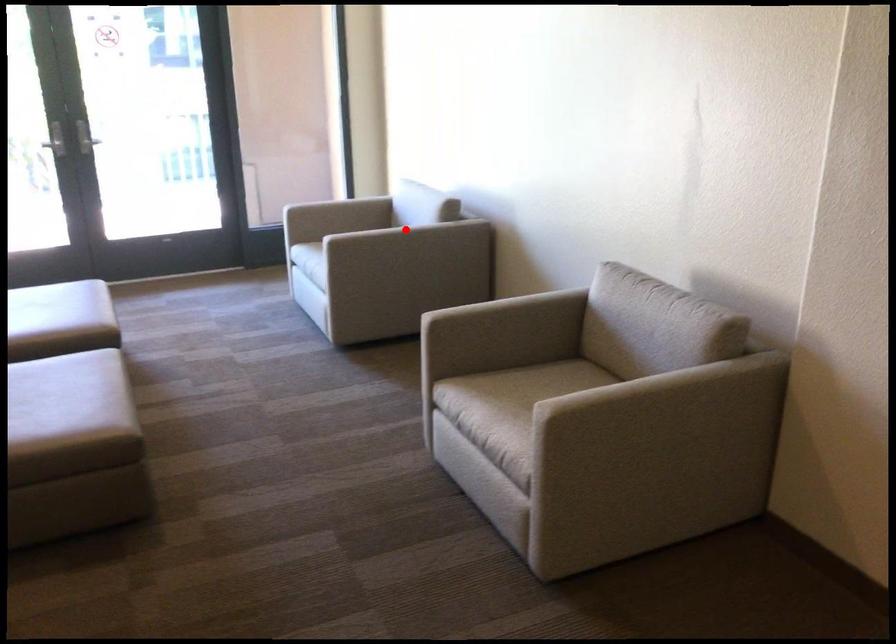
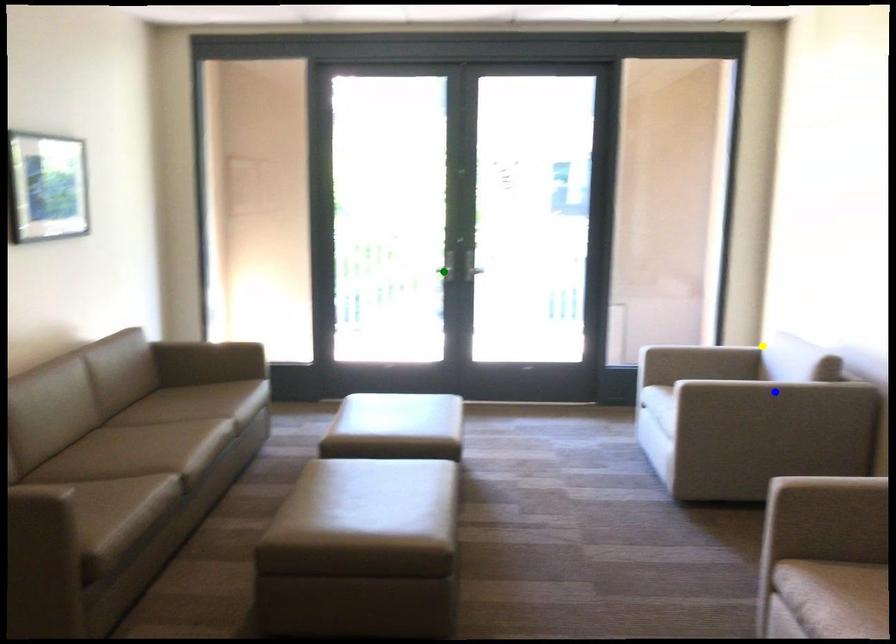
Question: I am providing you with two images of the same scene from different viewpoints. A red point is marked on the first image. You are given multiple points on the second image. In image 2, which mark is for the same physical point as the one in image 1?

Choices:
 (A) blue point
 (B) green point
 (C) yellow point

Answer: (A)